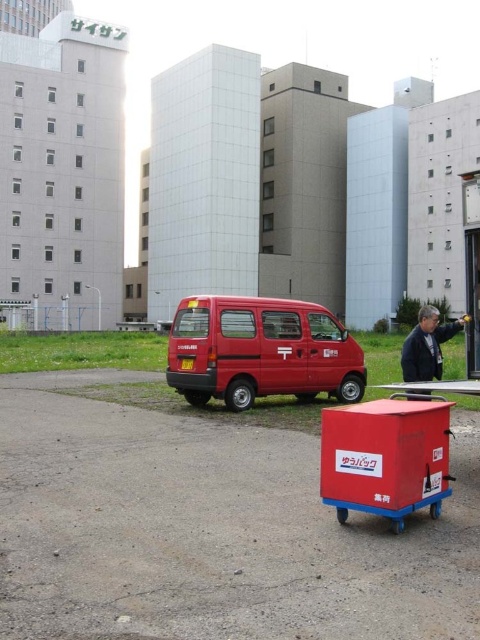
Question: Which of these objects is positioned closest to the matte red cart at center?

Choices:
 (A) black leather jacket at lower right
 (B) red plastic cart at center

Answer: (B)

Question: Estimate the real-world distances between objects in this image. Which object is farther from the matte red cart at center?

Choices:
 (A) black leather jacket at lower right
 (B) red plastic cart at center
 (C) matte red van at center

Answer: (A)

Question: Which of these objects is positioned closest to the black leather jacket at lower right?

Choices:
 (A) matte red van at center
 (B) red plastic cart at center
 (C) matte red cart at center

Answer: (B)

Question: Can you confirm if black leather jacket at lower right is positioned below matte red cart at center?

Choices:
 (A) yes
 (B) no

Answer: (B)

Question: Can you confirm if matte red van at center is positioned below matte red cart at center?

Choices:
 (A) yes
 (B) no

Answer: (B)

Question: Is red plastic cart at center smaller than matte red cart at center?

Choices:
 (A) yes
 (B) no

Answer: (A)